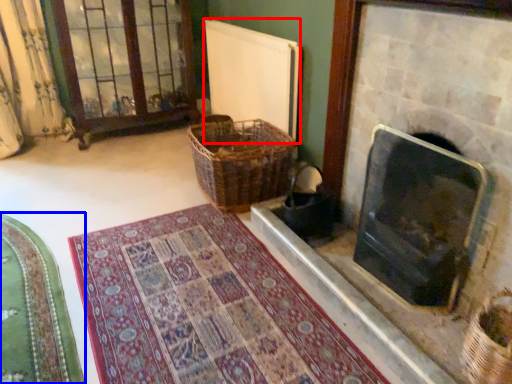
Question: Which of the following is the farthest to the observer, radiator (highlighted by a red box) or mat (highlighted by a blue box)?

Choices:
 (A) radiator
 (B) mat

Answer: (A)